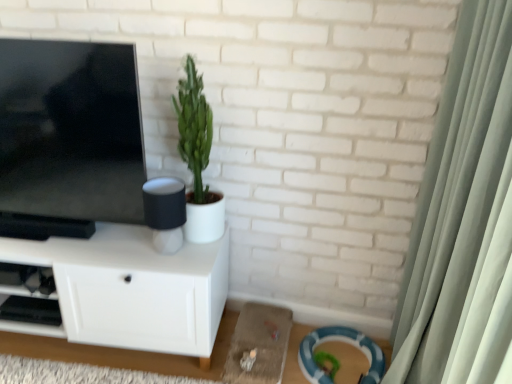
Where is `free space in front of green matte plant at center`? Image resolution: width=512 pixels, height=384 pixels. free space in front of green matte plant at center is located at coordinates (187, 261).